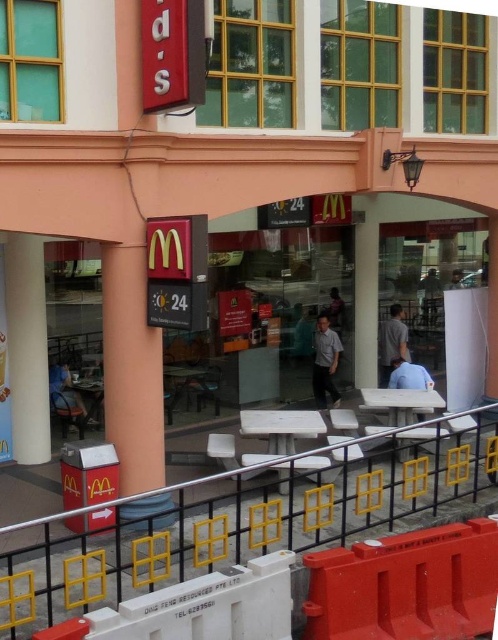
Who is more forward, (244, 547) or (59, 385)?

Point (244, 547)

Is point (129, 564) farther from camera compared to point (55, 388)?

No, it is not.

Between point (34, 522) and point (52, 381), which one is positioned in front?

Point (34, 522)

Find the location of `metallic yellow fence at lower center`. metallic yellow fence at lower center is located at coordinates (239, 516).

Who is shorter, matte black chair at lower left or blue fabric shirt at lower center?

With less height is blue fabric shirt at lower center.

Does matte black chair at lower left appear on the left side of blue fabric shirt at lower center?

Yes, matte black chair at lower left is to the left of blue fabric shirt at lower center.

Who is more forward, (90, 422) or (400, 387)?

Point (400, 387) is more forward.

Identify the location of matte black chair at lower left. (65, 390).

Which is behind, point (382, 355) or point (329, 320)?

Point (329, 320)

Does gray fabric shirt at center appear under dark gray shirt at center?

Indeed, gray fabric shirt at center is positioned under dark gray shirt at center.

Is point (393, 307) closer to camera compared to point (327, 314)?

Yes, point (393, 307) is in front of point (327, 314).

You are a GUI agent. You are given a task and a screenshot of the screen. Output one action in this format:
    pyautogui.click(x=<x>, y=<y>)
    Task: Click on the gray fabric shirt at center
    This screenshot has width=498, height=640.
    Given the screenshot: What is the action you would take?
    pyautogui.click(x=391, y=342)